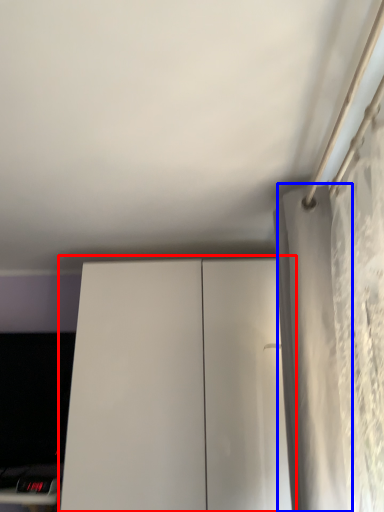
Question: Which of the following is the closest to the observer, dresser (highlighted by a red box) or curtain (highlighted by a blue box)?

Choices:
 (A) dresser
 (B) curtain

Answer: (B)